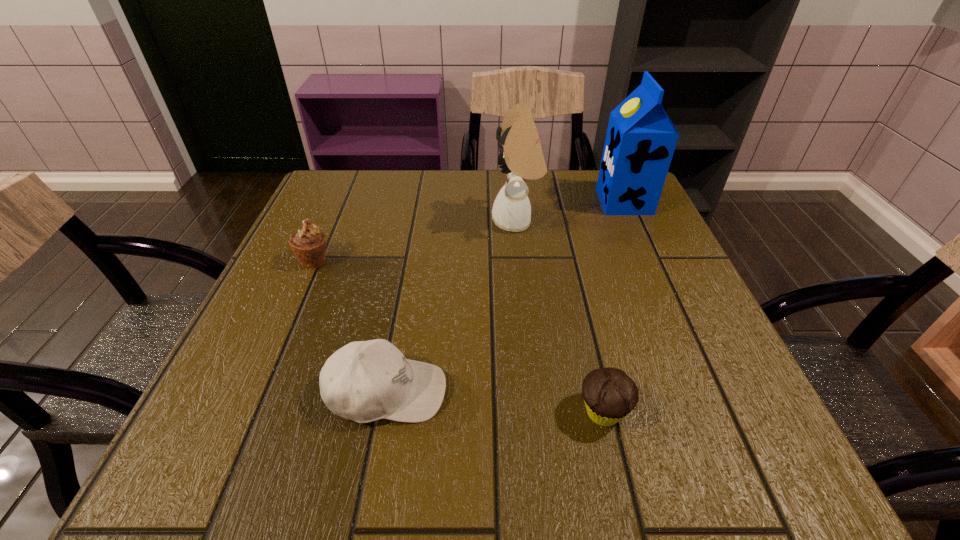
The image size is (960, 540). What are the coordinates of `free location located at the front face of the doll` in the screenshot? It's located at (436, 221).

This screenshot has width=960, height=540. I want to click on vacant space located at the front face of the doll, so click(368, 221).

Image resolution: width=960 pixels, height=540 pixels. What are the coordinates of `free location located 0.200m at the front face of the doll` in the screenshot? It's located at (406, 221).

Where is `vacant point located on the back of the left muffin`? The width and height of the screenshot is (960, 540). vacant point located on the back of the left muffin is located at coordinates (x=333, y=216).

Image resolution: width=960 pixels, height=540 pixels. Identify the location of free location located 0.250m on the front-facing side of the second object from left to right. (607, 392).

Identify the location of free space located 0.070m on the back of the shorter muffin. This screenshot has height=540, width=960. (589, 353).

Where is `carton that is at the far edge`? carton that is at the far edge is located at coordinates (640, 141).

Identify the location of doll at the far edge. Image resolution: width=960 pixels, height=540 pixels. (521, 157).

At what (x,y) coordinates should I click in order to perform the action: click on baseball cap that is at the near edge. Please return your answer as a coordinate pair (x, y). This screenshot has height=540, width=960. Looking at the image, I should click on (364, 381).

The image size is (960, 540). Find the location of `muffin located at the near edge`. muffin located at the near edge is located at coordinates pyautogui.click(x=609, y=394).